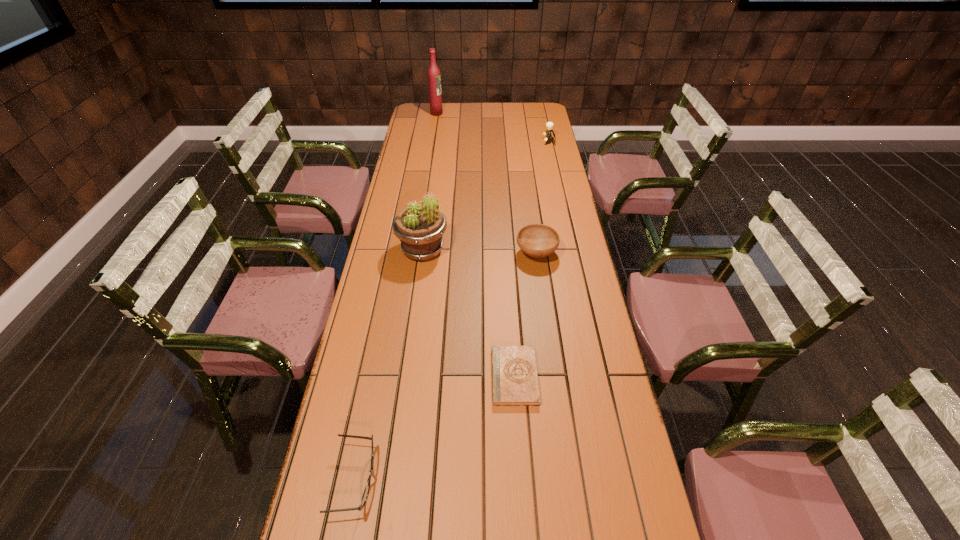
Where is `the tallest object`? the tallest object is located at coordinates (434, 79).

Find the location of a particular element. This screenshot has width=960, height=540. the farthest object is located at coordinates (434, 79).

Where is `the second tallest object`? The width and height of the screenshot is (960, 540). the second tallest object is located at coordinates (420, 228).

The width and height of the screenshot is (960, 540). Find the location of `the fifth nearest object`. the fifth nearest object is located at coordinates (549, 125).

At what (x,y) coordinates should I click in order to perform the action: click on Lego. Please return your answer as a coordinate pair (x, y). Looking at the image, I should click on (549, 125).

You are a GUI agent. You are given a task and a screenshot of the screen. Output one action in this format:
    pyautogui.click(x=<x>, y=<y>)
    Task: Click on the bowl
    Image resolution: width=960 pixels, height=540 pixels.
    Given the screenshot: What is the action you would take?
    pyautogui.click(x=536, y=240)

Find the location of a particular element. This screenshot has height=540, width=960. spectacles is located at coordinates (366, 491).

You are a GUI agent. You are given a task and a screenshot of the screen. Output one action in this format:
    pyautogui.click(x=<x>, y=<y>)
    Task: Click on the fifth tallest object
    The height and width of the screenshot is (540, 960).
    Given the screenshot: What is the action you would take?
    pyautogui.click(x=366, y=491)

You are a GUI agent. You are given a task and a screenshot of the screen. Output one action in this format:
    pyautogui.click(x=<x>, y=<y>)
    Task: Click on the fifth farthest object
    This screenshot has width=960, height=540.
    Given the screenshot: What is the action you would take?
    pyautogui.click(x=514, y=373)

Where is `diary`? This screenshot has width=960, height=540. diary is located at coordinates (514, 373).